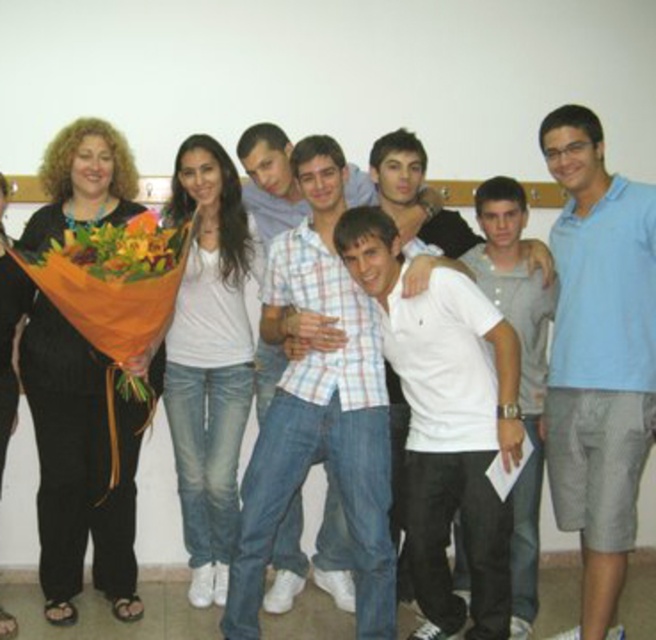
Question: Which object is positioned closest to the vibrant floral bouquet at left?

Choices:
 (A) light blue polo shirt at right
 (B) plaid shirt at center
 (C) white cotton shirt at center
 (D) orange paper wrapped bouquet at left

Answer: (D)

Question: Which point is closer to the camera?

Choices:
 (A) white cotton shirt at center
 (B) plaid shirt at center
 (C) vibrant floral bouquet at left

Answer: (C)

Question: Which of the following is the farthest from the observer?

Choices:
 (A) (270, 268)
 (B) (508, 188)

Answer: (B)

Question: Is orange paper wrapped bouquet at left positioned behind vibrant floral bouquet at left?

Choices:
 (A) yes
 (B) no

Answer: (B)

Question: In this image, where is light blue polo shirt at right located relative to orange paper wrapped bouquet at left?

Choices:
 (A) below
 (B) above

Answer: (A)

Question: Considering the relative positions of plaid shirt at center and vibrant floral bouquet at left in the image provided, where is plaid shirt at center located with respect to vibrant floral bouquet at left?

Choices:
 (A) above
 (B) below

Answer: (B)